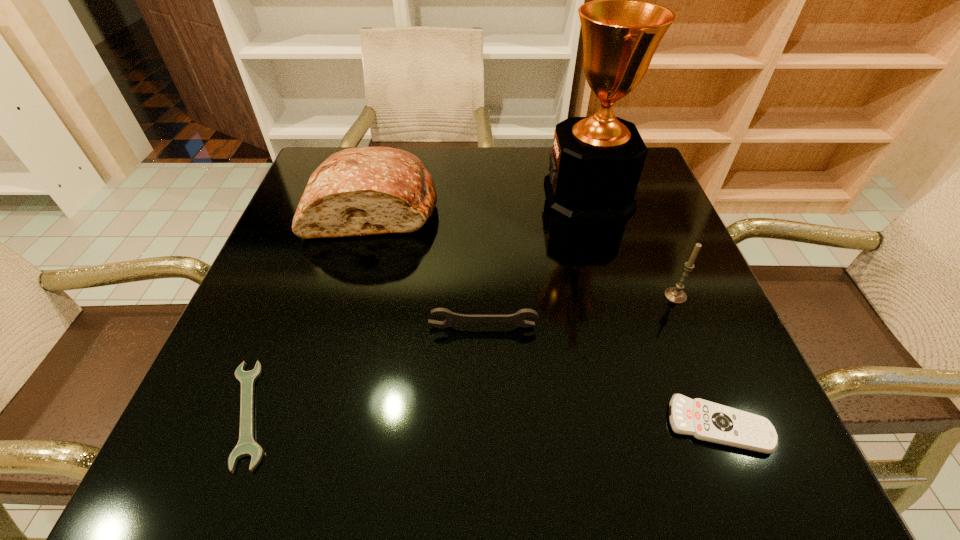
The width and height of the screenshot is (960, 540). Identify the location of free space located on the front of the trophy cup with the label. (514, 195).

Locate an element on the screen. free spot located at the sliced front of the bread is located at coordinates (340, 330).

Where is `free space located on the front of the third farthest object`? Image resolution: width=960 pixels, height=540 pixels. free space located on the front of the third farthest object is located at coordinates (699, 353).

Find the location of a particular element. Image resolution: width=960 pixels, height=540 pixels. vacant space located on the open ends of the third nearest object is located at coordinates (484, 406).

Where is `free space located on the left of the remote control`? This screenshot has width=960, height=540. free space located on the left of the remote control is located at coordinates (516, 425).

At what (x,y) coordinates should I click in order to perform the action: click on vacant position located on the right of the shorter wrench. Please return your answer as a coordinate pair (x, y). Looking at the image, I should click on (441, 413).

Image resolution: width=960 pixels, height=540 pixels. I want to click on trophy cup that is at the far edge, so click(x=596, y=162).

This screenshot has height=540, width=960. I want to click on bread that is at the far edge, so click(359, 191).

Find the location of a particular element. The height and width of the screenshot is (540, 960). remote control present at the near edge is located at coordinates (704, 420).

Locate an element on the screen. The image size is (960, 540). wrench situated at the near edge is located at coordinates (246, 446).